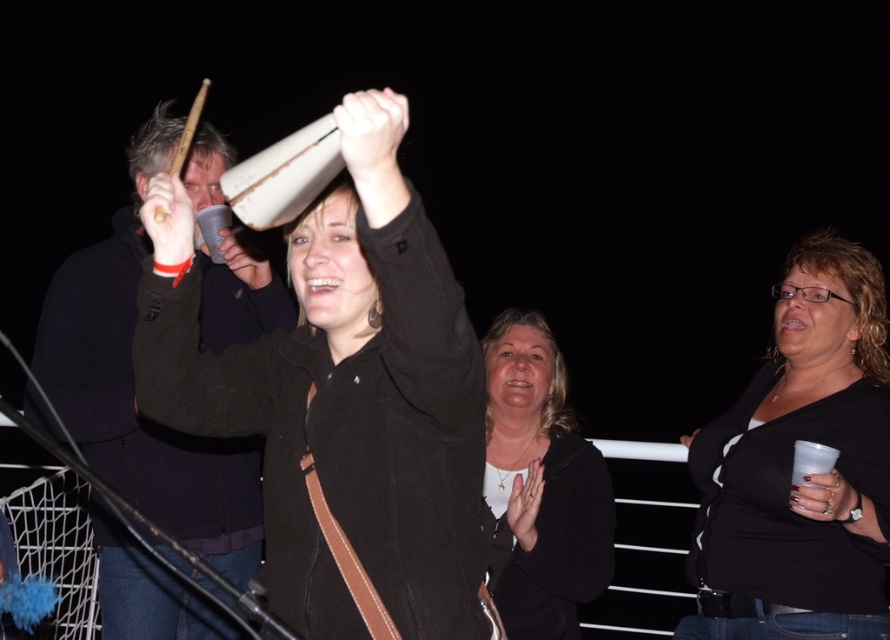
Question: Which point is closer to the camera?

Choices:
 (A) matte black jacket at center
 (B) black matte shirt at center

Answer: (B)

Question: From the image, what is the correct spatial relationship of black matte shirt at center in relation to matte black jacket at center?

Choices:
 (A) below
 (B) above

Answer: (B)

Question: From the image, what is the correct spatial relationship of black matte shirt at center in relation to matte black jacket at center?

Choices:
 (A) above
 (B) below

Answer: (A)

Question: Can you confirm if black matte shirt at center is wider than matte black jacket at center?

Choices:
 (A) no
 (B) yes

Answer: (B)

Question: Which object appears closest to the camera in this image?

Choices:
 (A) matte black jacket at center
 (B) black matte shirt at center

Answer: (B)